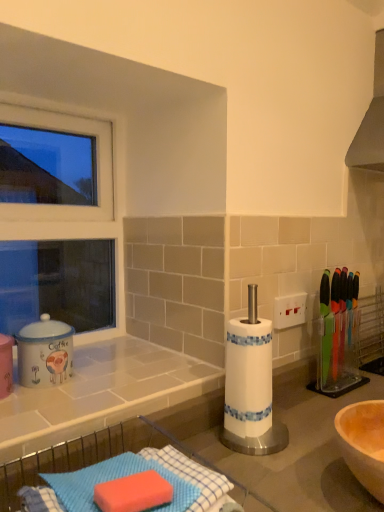
Question: From a real-world perspective, is white plastic window frame at upper left physically located above or below white tile countertop at lower left, the 1th countertop viewed from the top?

Choices:
 (A) above
 (B) below

Answer: (A)

Question: Does point (114, 206) appear closer or farther from the camera than point (142, 346)?

Choices:
 (A) farther
 (B) closer

Answer: (A)

Question: Which is farther from the white plastic window frame at upper left?

Choices:
 (A) white tile countertop at lower left, the second countertop from the bottom
 (B) matte ceramic coffee canister at left
 (C) blue textured sponge at lower left, placed as the first countertop when sorted from bottom to top

Answer: (C)

Question: Considering the real-world distances, which object is closest to the white plastic window frame at upper left?

Choices:
 (A) matte ceramic coffee canister at left
 (B) blue textured sponge at lower left, placed as the first countertop when sorted from bottom to top
 (C) white tile countertop at lower left, the 1th countertop viewed from the top

Answer: (A)